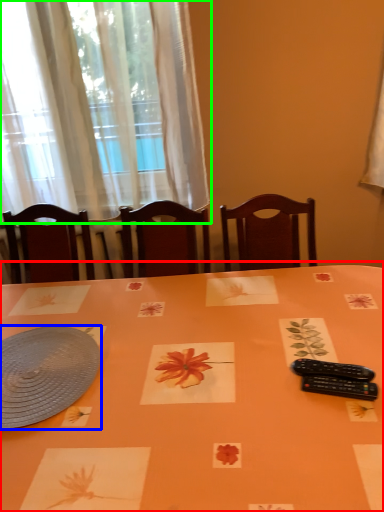
Question: Considering the real-world distances, which object is closest to table (highlighted by a red box)? platter (highlighted by a blue box) or curtain (highlighted by a green box).

Choices:
 (A) platter
 (B) curtain

Answer: (A)